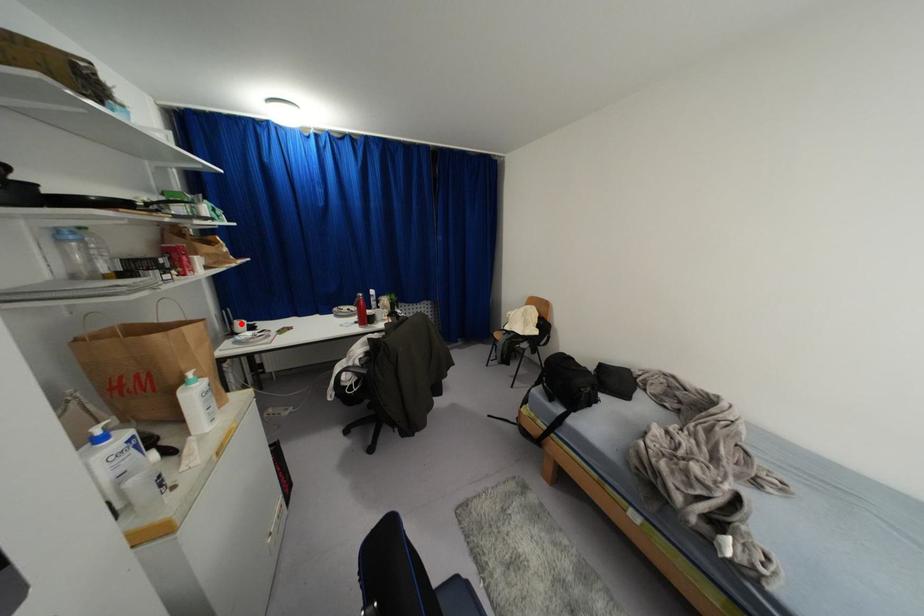
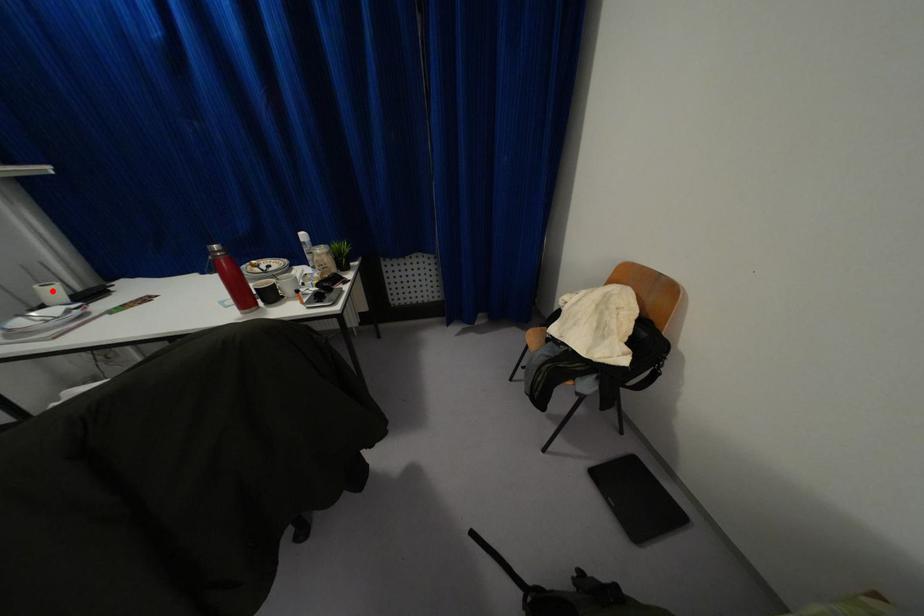
I am providing you with two images of the same scene from different viewpoints. A red point is marked on the first image and another point is marked on the second image. Is the red point in image1 aligned with the point shown in image2?

Yes